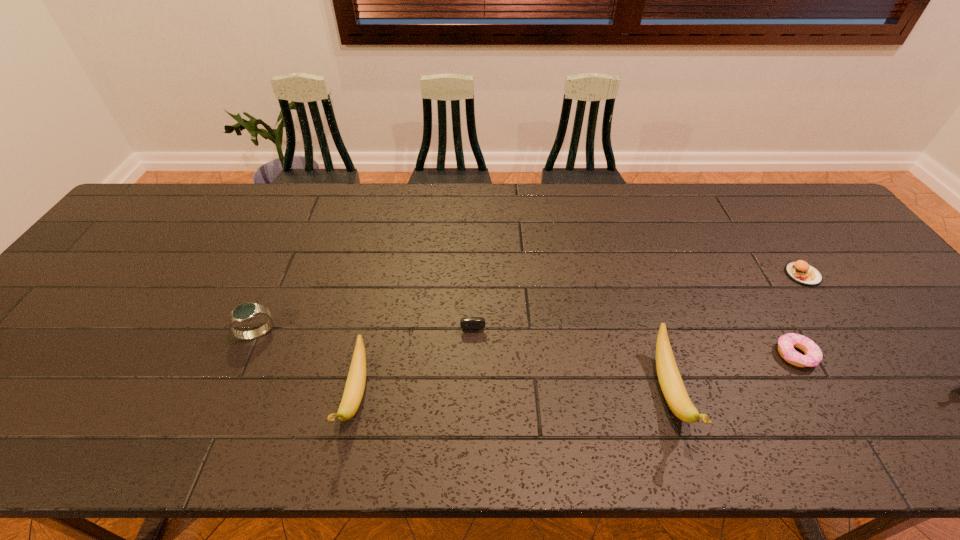
What are the coordinates of `vacant area located 0.250m on the back of the patty` in the screenshot? It's located at (756, 208).

The height and width of the screenshot is (540, 960). I want to click on vacant region located on the right of the leftmost object, so click(359, 334).

At what (x,y) coordinates should I click in order to perform the action: click on vacant space located 0.270m on the left of the fifth object from left to right. Please return your answer as a coordinate pair (x, y). This screenshot has width=960, height=540. Looking at the image, I should click on (660, 355).

This screenshot has width=960, height=540. In order to click on doughnut that is at the near edge in this screenshot , I will do `click(813, 356)`.

Locate an element on the screen. free space at the far edge is located at coordinates (541, 214).

The image size is (960, 540). Find the location of `free region at the far left corner`. free region at the far left corner is located at coordinates tap(166, 222).

At what (x,y) coordinates should I click in order to perform the action: click on blank space at the far right corner of the desktop. Please return your answer as a coordinate pair (x, y). The height and width of the screenshot is (540, 960). Looking at the image, I should click on (787, 204).

The height and width of the screenshot is (540, 960). I want to click on vacant space that is in between the doughnut and the leftmost object, so click(x=526, y=345).

The width and height of the screenshot is (960, 540). Find the location of `free space between the fourth shortest object and the patty`. free space between the fourth shortest object and the patty is located at coordinates (530, 304).

You are a GUI agent. You are given a task and a screenshot of the screen. Output one action in this format:
    pyautogui.click(x=<x>, y=<y>)
    Task: Click on the free space between the left banana and the third object from right to left
    The width and height of the screenshot is (960, 540).
    Given the screenshot: What is the action you would take?
    pyautogui.click(x=513, y=394)